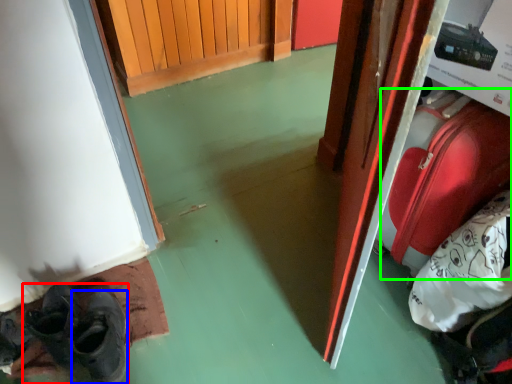
Question: Estimate the real-world distances between objects in this image. Which object is farther from footwear (highlighted by a red box), shoe (highlighted by a blue box) or luggage (highlighted by a green box)?

Choices:
 (A) shoe
 (B) luggage

Answer: (B)